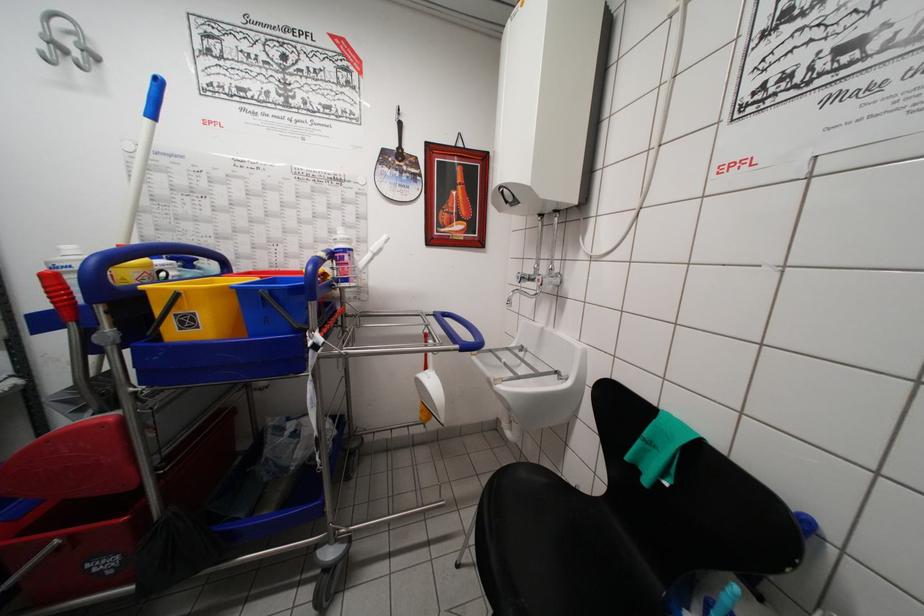
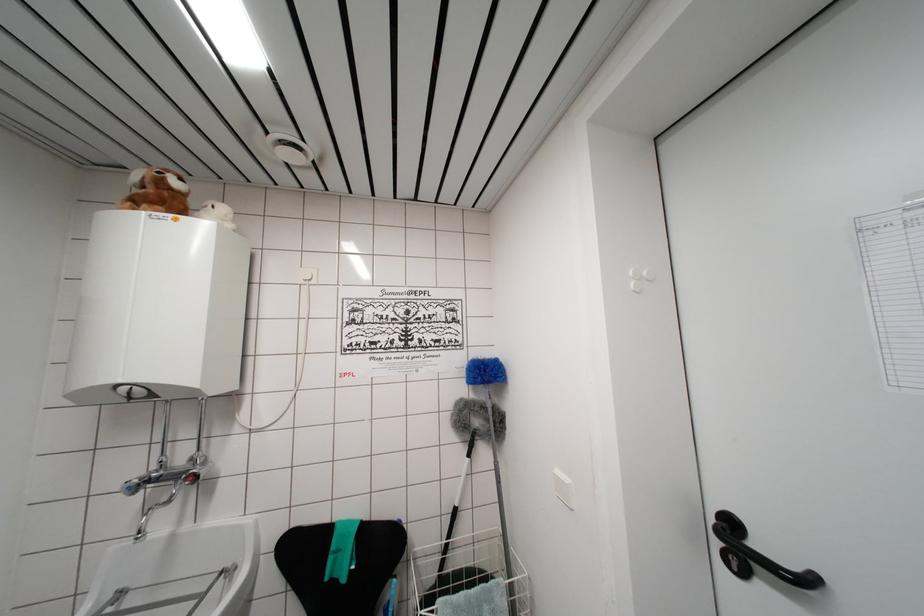
In the second image, find the point that corresponds to point 521,282 in the first image.

(132, 493)